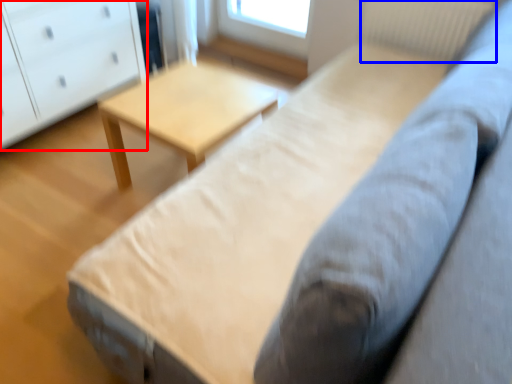
Question: Among these objects, which one is farthest to the camera, chest of drawers (highlighted by a red box) or radiator (highlighted by a blue box)?

Choices:
 (A) chest of drawers
 (B) radiator

Answer: (B)